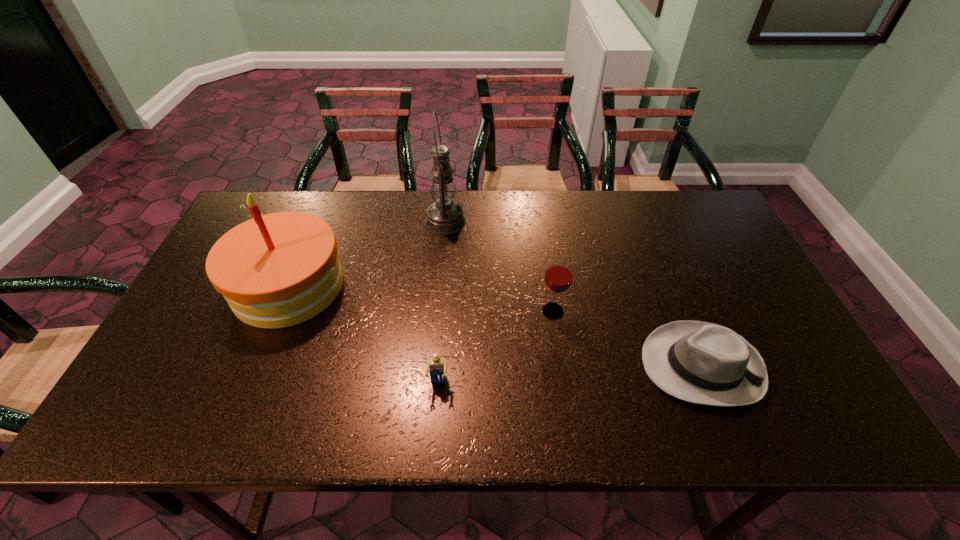
The image size is (960, 540). I want to click on vacant area that lies between the oil lamp and the birthday cake, so (367, 254).

In order to click on empty location between the fedora and the farthest object in this screenshot , I will do (x=573, y=294).

You are a GUI agent. You are given a task and a screenshot of the screen. Output one action in this format:
    pyautogui.click(x=<x>, y=<y>)
    Task: Click on the empty space that is in between the Lego and the oil lamp
    This screenshot has width=960, height=540.
    Given the screenshot: What is the action you would take?
    pyautogui.click(x=442, y=303)

Identify the location of free spot between the Lego and the second tallest object. (363, 335).

Find the location of `free space that is in between the Lego and the rightmost object`. free space that is in between the Lego and the rightmost object is located at coordinates (570, 375).

The image size is (960, 540). What are the coordinates of `the third closest object to the rightmost object` in the screenshot? It's located at (445, 216).

The height and width of the screenshot is (540, 960). In order to click on object that stands as the third closest to the Lego in this screenshot , I will do `click(704, 363)`.

The width and height of the screenshot is (960, 540). I want to click on free space that satisfies the following two spatial constraints: 1. on the front-facing side of the rightmost object; 2. on the face of the Lego, so click(x=708, y=384).

Where is `free spot that satisfies the following two spatial constraints: 1. on the front-facing side of the rightmost object; 2. on the face of the Lego`? Image resolution: width=960 pixels, height=540 pixels. free spot that satisfies the following two spatial constraints: 1. on the front-facing side of the rightmost object; 2. on the face of the Lego is located at coordinates (708, 384).

The height and width of the screenshot is (540, 960). I want to click on free spot that satisfies the following two spatial constraints: 1. on the front side of the birthday cake; 2. on the left side of the third tallest object, so click(x=278, y=311).